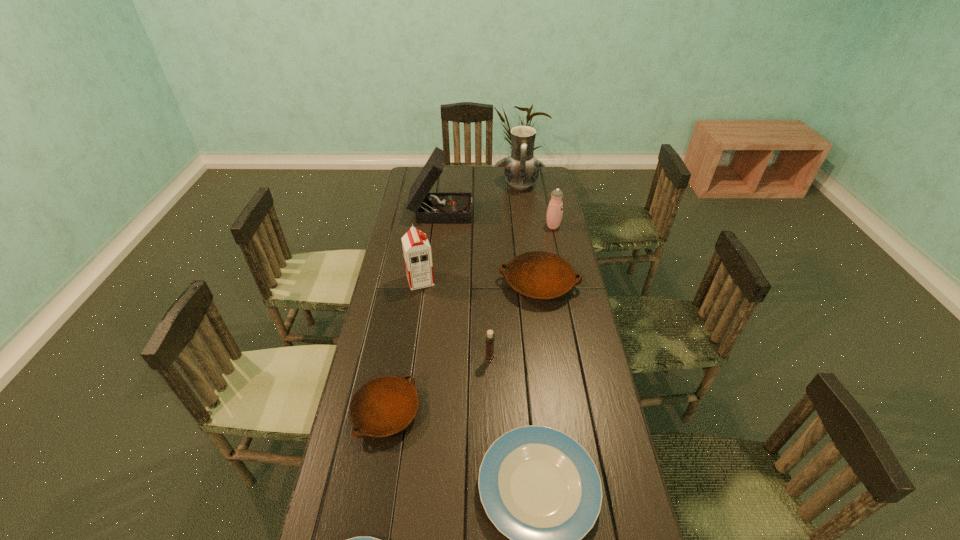
Image resolution: width=960 pixels, height=540 pixels. Identify the location of phonograph_record positioned at the left edge. (428, 207).

The width and height of the screenshot is (960, 540). Find the location of `soya milk situated at the left edge`. soya milk situated at the left edge is located at coordinates (417, 252).

Locate an element on the screen. The height and width of the screenshot is (540, 960). plate that is at the left edge is located at coordinates coord(383,406).

In order to click on pitcher present at the right edge in this screenshot , I will do `click(521, 170)`.

You are a GUI agent. You are given a task and a screenshot of the screen. Output one action in this format:
    pyautogui.click(x=<x>, y=<y>)
    Task: Click on the thermos bottle that is at the right edge
    This screenshot has height=540, width=960.
    Given the screenshot: What is the action you would take?
    pyautogui.click(x=555, y=208)

In order to click on plate that is positioned at the right edge in this screenshot , I will do `click(539, 275)`.

In order to click on object that is at the far right corner in this screenshot , I will do pyautogui.click(x=521, y=170).

Locate an element on the screen. The height and width of the screenshot is (540, 960). vacant area at the far edge is located at coordinates (476, 181).

Where is `vacant region at the left edge`? This screenshot has width=960, height=540. vacant region at the left edge is located at coordinates (387, 368).

Identify the location of free region at the right edge of the desktop. The width and height of the screenshot is (960, 540). (562, 411).